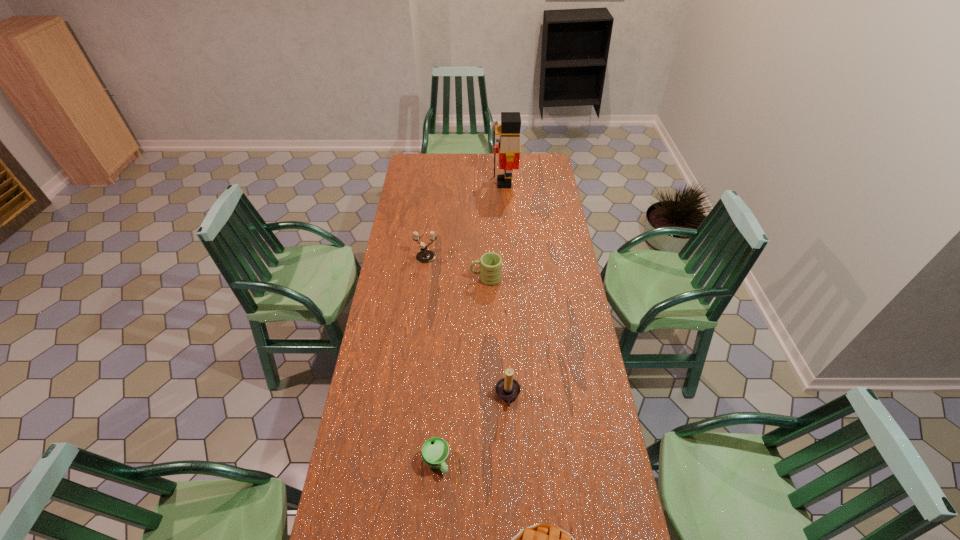
At what (x,y) coordinates should I click in order to perform the action: click on the farthest object. Please return your answer as a coordinate pair (x, y). This screenshot has height=540, width=960. Looking at the image, I should click on (509, 148).

The width and height of the screenshot is (960, 540). I want to click on the tallest object, so click(x=509, y=148).

Locate an element on the screen. Image resolution: width=960 pixels, height=540 pixels. the third nearest object is located at coordinates point(507,388).

The width and height of the screenshot is (960, 540). In order to click on the nearer candle holder in this screenshot , I will do `click(507, 388)`.

Find the location of a particular element. The image size is (960, 540). the leftmost object is located at coordinates click(x=424, y=256).

The height and width of the screenshot is (540, 960). Find the location of `the farther candle holder`. the farther candle holder is located at coordinates (424, 256).

What are the coordinates of `the third shortest object` in the screenshot? It's located at (490, 272).

Locate an element on the screen. The image size is (960, 540). the third farthest object is located at coordinates (x=490, y=272).

Find the location of a particular element. The width and height of the screenshot is (960, 540). the fifth tallest object is located at coordinates (435, 451).

Find the location of a particular element. Image resolution: width=960 pixels, height=540 pixels. the second object from left to right is located at coordinates (435, 451).